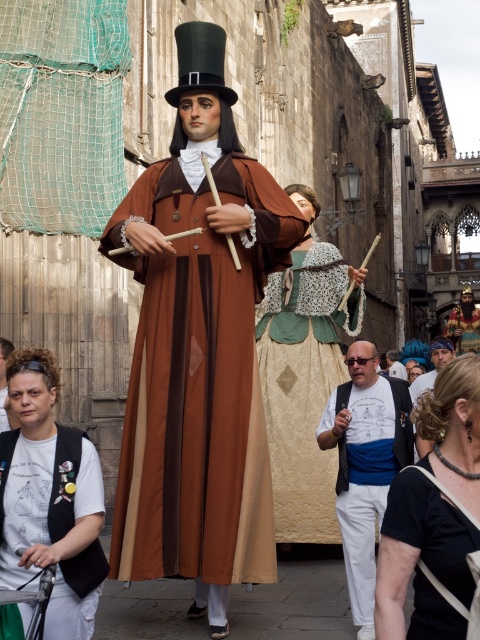
Question: Does black velvet vest at lower left have a lesser width compared to black matte robe at center?

Choices:
 (A) yes
 (B) no

Answer: (A)

Question: Which is nearer to the white cotton t-shirt at center?

Choices:
 (A) gold metallic mask at center
 (B) black matte robe at center
 (C) white cotton shirt at center

Answer: (B)

Question: Does brown satin robe at center have a greater width compared to gold metallic mask at center?

Choices:
 (A) no
 (B) yes

Answer: (B)

Question: Which point appears closest to the camera in this image?

Choices:
 (A) (411, 401)
 (B) (434, 547)
 (C) (355, 419)
 (D) (128, 552)

Answer: (B)

Question: Does white cotton t-shirt at center appear over brown velvet coat at center?

Choices:
 (A) no
 (B) yes

Answer: (A)

Question: Which of these objects is positioned closest to the black matte robe at center?

Choices:
 (A) black velvet vest at lower left
 (B) gold metallic mask at center

Answer: (A)